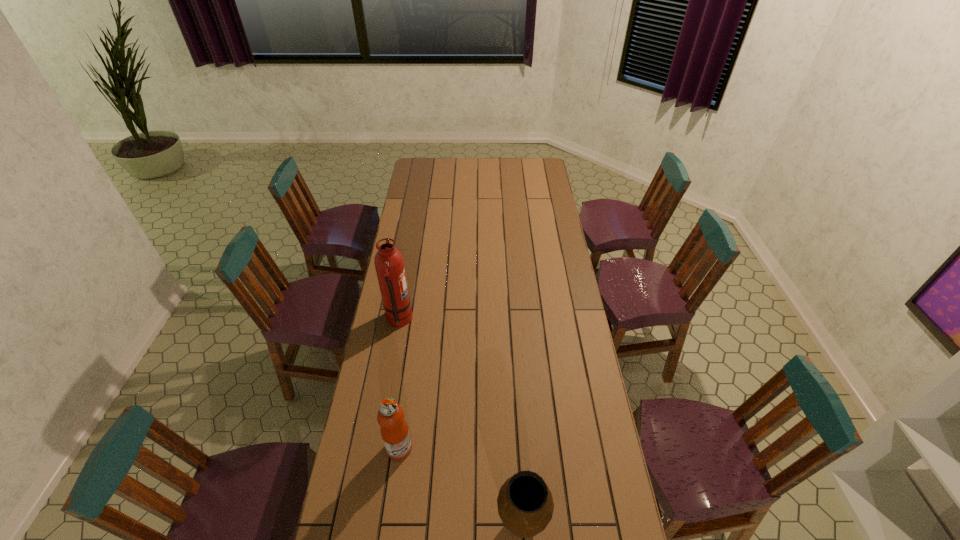
I want to click on the farthest object, so click(389, 264).

Where is `the tallest object`? the tallest object is located at coordinates (389, 264).

Identify the location of fruit juice. This screenshot has width=960, height=540. 394,430.

Locate an element on the screen. This screenshot has height=540, width=960. free location located on the label side of the tallest object is located at coordinates (497, 320).

Where is `free space located 0.110m on the front label of the fruit juice`? The image size is (960, 540). free space located 0.110m on the front label of the fruit juice is located at coordinates (445, 448).

Find the location of a particular element. The height and width of the screenshot is (540, 960). fire extinguisher located at the left edge is located at coordinates (389, 264).

Find the location of a particular element. Image resolution: width=960 pixels, height=540 pixels. fruit juice at the left edge is located at coordinates (394, 430).

In the image, there is a desktop. Identify the location of vacant space at the far edge. The height and width of the screenshot is (540, 960). (510, 167).

You are a GUI agent. You are given a task and a screenshot of the screen. Output one action in this format:
    pyautogui.click(x=<x>, y=<y>)
    Task: Click on the vacant area at the left edge of the desktop
    Image resolution: width=960 pixels, height=540 pixels.
    Given the screenshot: What is the action you would take?
    pyautogui.click(x=351, y=447)

At what (x,y) coordinates should I click in order to perform the action: click on free location at the right edge. Please return your answer as a coordinate pair (x, y). The width and height of the screenshot is (960, 540). Looking at the image, I should click on [536, 242].